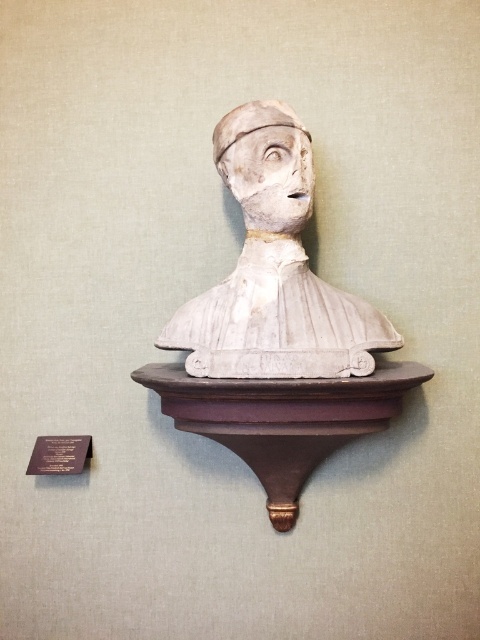
Question: Which of the following is the closest to the observer?

Choices:
 (A) (64, 470)
 (B) (216, 156)
 (C) (149, 369)
 (D) (352, 340)

Answer: (D)

Question: Can you confirm if brown polished wood at center is positioned above matte brown plaque at lower left?

Choices:
 (A) no
 (B) yes

Answer: (B)

Question: Which object appears closest to the camera in this image?

Choices:
 (A) brown polished wood at center
 (B) white clay bust at center
 (C) white plaster bust at center
 (D) matte brown plaque at lower left

Answer: (A)

Question: Does brown polished wood at center have a larger size compared to white clay bust at center?

Choices:
 (A) yes
 (B) no

Answer: (A)

Question: Among these points, which one is farthest from the camera?

Choices:
 (A) (253, 470)
 (B) (242, 340)
 (C) (284, 176)
 (D) (67, 452)

Answer: (D)

Question: In this image, where is white plaster bust at center located relative to brown polished wood at center?

Choices:
 (A) right
 (B) left

Answer: (B)